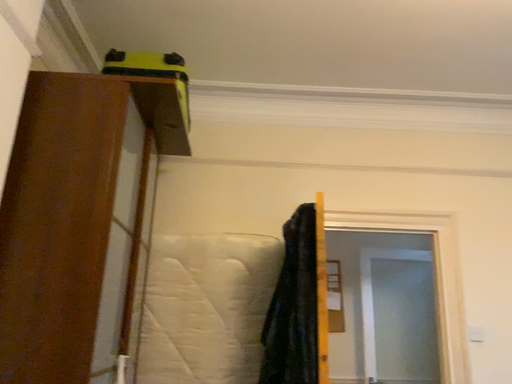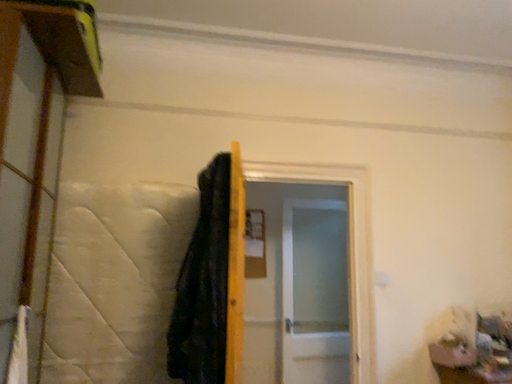
Question: How did the camera likely rotate when shooting the video?

Choices:
 (A) rotated downward
 (B) rotated upward

Answer: (A)